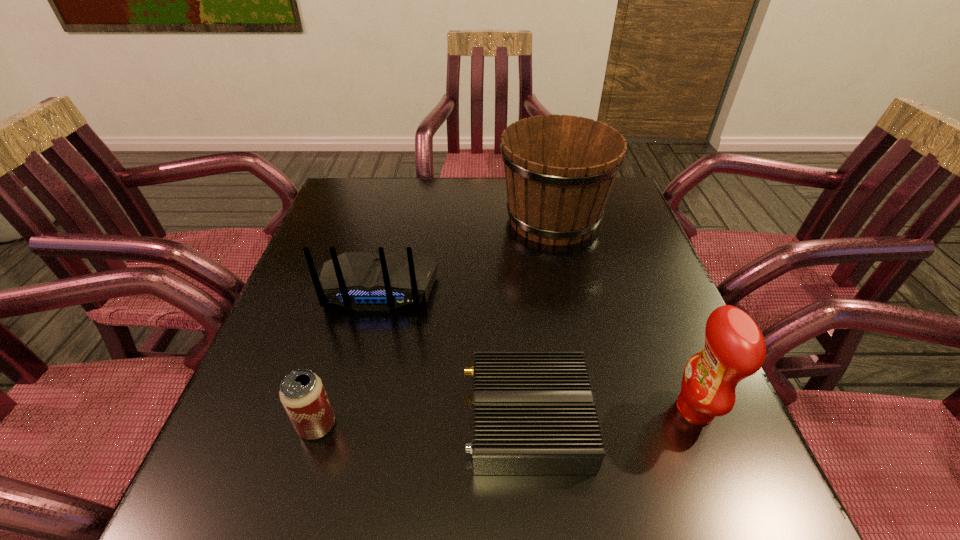
What are the coordinates of `the third closest object to the condiment` in the screenshot? It's located at (363, 281).

In order to click on vacant space that satisfies the following two spatial constraints: 1. on the back panel of the right router; 2. on the front side of the second shortest object in this screenshot , I will do click(x=529, y=426).

You are a GUI agent. You are given a task and a screenshot of the screen. Output one action in this format:
    pyautogui.click(x=<x>, y=<y>)
    Task: Click on the vacant region that satisfies the following two spatial constraints: 1. on the back panel of the nearer router; 2. on the front side of the beer can
    
    Given the screenshot: What is the action you would take?
    pyautogui.click(x=529, y=426)

Identify the location of vacant space that satisfies the following two spatial constraints: 1. on the back side of the wine bucket; 2. on the right side of the second shortest object. This screenshot has width=960, height=540. (379, 219).